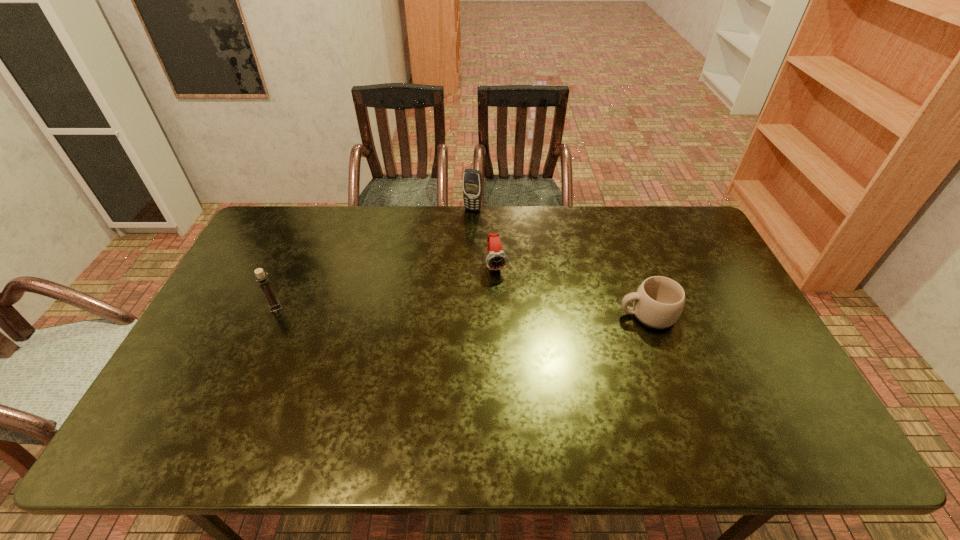
Where is `free space on the desktop that is between the leftmost object and the mug and is positioned on the face of the third nearest object`? free space on the desktop that is between the leftmost object and the mug and is positioned on the face of the third nearest object is located at coordinates (508, 312).

Where is `vacant space on the desktop that is between the leftmost object and the mug and is positioned on the front face of the cellular telephone`? Image resolution: width=960 pixels, height=540 pixels. vacant space on the desktop that is between the leftmost object and the mug and is positioned on the front face of the cellular telephone is located at coordinates (424, 310).